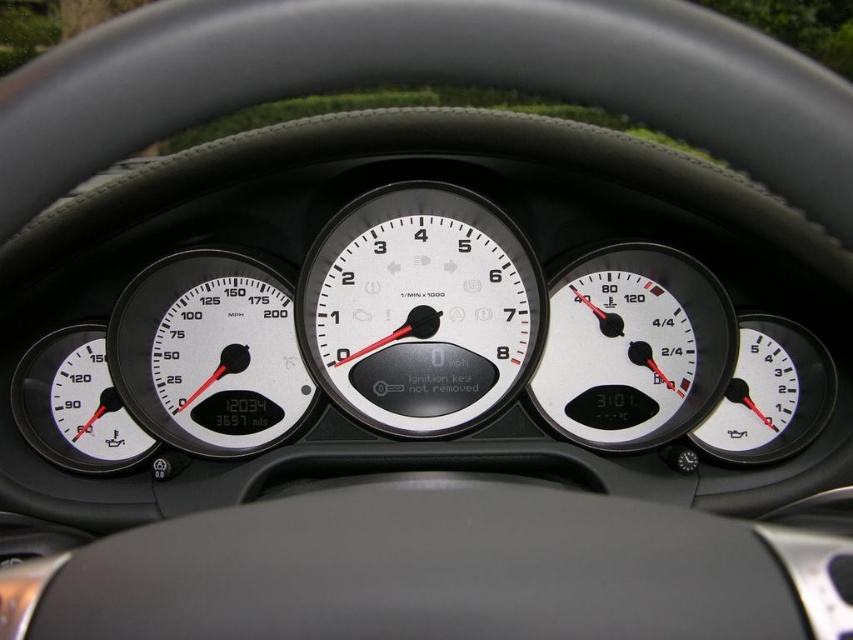
Question: Is white glossy speedometer at center left to the left of white matte gauge at center right from the viewer's perspective?

Choices:
 (A) no
 (B) yes

Answer: (B)

Question: Considering the real-world distances, which object is closest to the white glossy speedometer at center?

Choices:
 (A) white matte gauge at center right
 (B) white glossy speedometer at center left
 (C) matte white speedometer at lower left

Answer: (B)

Question: Is white glossy speedometer at center above matte white speedometer at lower left?

Choices:
 (A) yes
 (B) no

Answer: (A)

Question: Which point is farther to the camera?

Choices:
 (A) (471, 275)
 (B) (734, 452)
 (C) (659, 380)

Answer: (C)

Question: Considering the relative positions of white glossy speedometer at center and white glossy speedometer at center left in the image provided, where is white glossy speedometer at center located with respect to white glossy speedometer at center left?

Choices:
 (A) below
 (B) above

Answer: (B)

Question: Estimate the real-world distances between objects in this image. Which object is farther from the white matte gauge at center right?

Choices:
 (A) white glossy speedometer at center
 (B) white glossy speedometer at center left
 (C) matte white speedometer at lower left
 (D) white glossy speedometer at center right

Answer: (C)